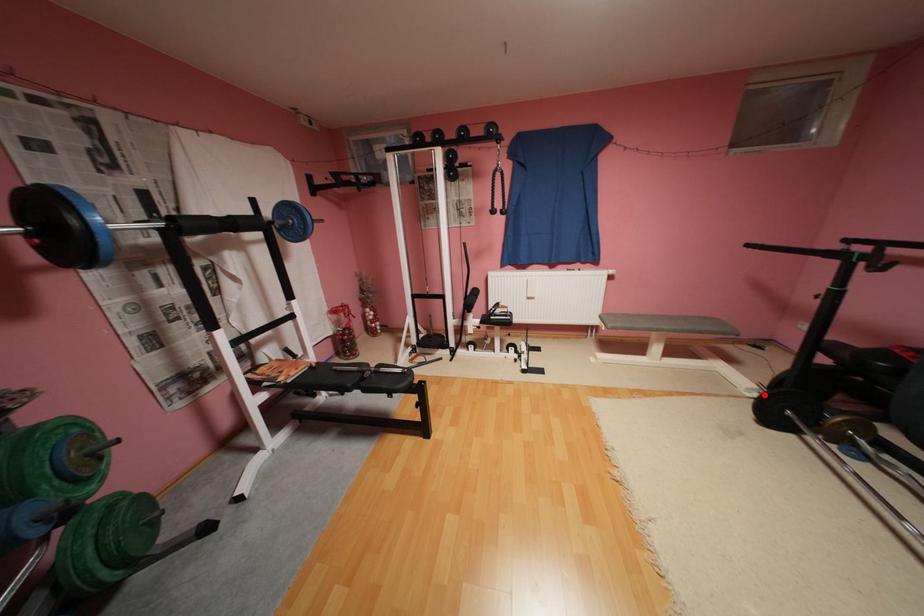
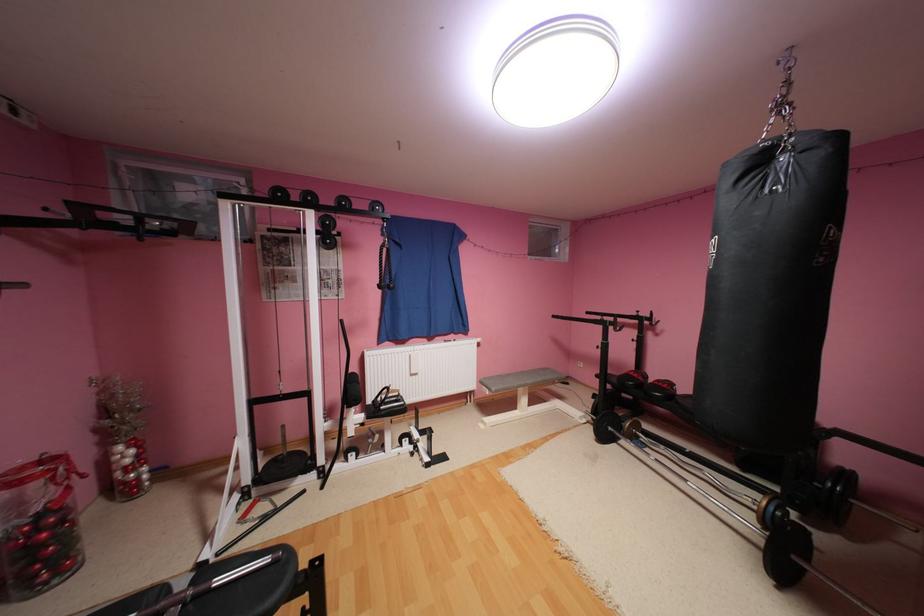
Find the pixel in the second image that matches the highlighted location in the first image.

(593, 419)